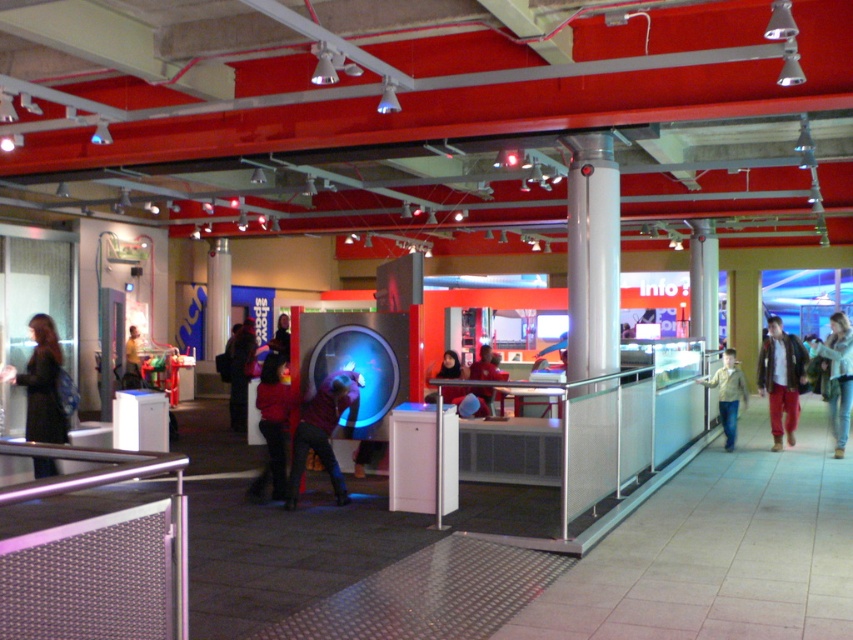
You are standing at the entrance of the science museum and see two points marked on the floor. The first point is at coordinate point (x=817, y=358) and the second is at point (x=283, y=317). If you want to move from the entrance to the second point, will you pass by the first point along the way?

Point (x=817, y=358) is in front of point (x=283, y=317), so moving from the entrance to the second point would require passing by the first point.

You are a security guard in the museum. You notice a denim jacket at right and a yellow shirt at center. Which clothing item is positioned higher in the scene?

The denim jacket at right is above the yellow shirt at center, so it is positioned higher in the scene.